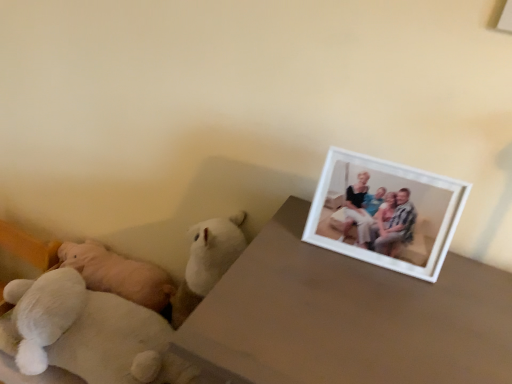
Question: Considering the relative positions of white plush teddy bear at left, which ranks as the 1th teddy bear in left-to-right order, and white plush teddy bear at lower left, the first teddy bear when ordered from right to left, in the image provided, is white plush teddy bear at left, which ranks as the 1th teddy bear in left-to-right order, to the right of white plush teddy bear at lower left, the first teddy bear when ordered from right to left, from the viewer's perspective?

Choices:
 (A) yes
 (B) no

Answer: (B)

Question: From a real-world perspective, does white plush teddy bear at left, marked as the first teddy bear in a back-to-front arrangement, sit lower than white plush teddy bear at lower left, the first teddy bear viewed from the front?

Choices:
 (A) no
 (B) yes

Answer: (B)

Question: Is white plush teddy bear at lower left, the first teddy bear viewed from the front, located within white plush teddy bear at left, which ranks as the 1th teddy bear in left-to-right order?

Choices:
 (A) no
 (B) yes

Answer: (A)

Question: Is the position of white plush teddy bear at left, marked as the first teddy bear in a back-to-front arrangement, less distant than that of white plush teddy bear at lower left, the first teddy bear when ordered from right to left?

Choices:
 (A) no
 (B) yes

Answer: (A)

Question: Can you confirm if white plush teddy bear at left, the 2th teddy bear positioned from the front, is thinner than white plush teddy bear at lower left, which is the 2th teddy bear in left-to-right order?

Choices:
 (A) no
 (B) yes

Answer: (B)

Question: Is white plush teddy bear at left, the 2th teddy bear positioned from the front, bigger than white plush teddy bear at lower left, the first teddy bear viewed from the front?

Choices:
 (A) yes
 (B) no

Answer: (A)

Question: Is white matte picture frame at upper right not close to white matte table at upper right?

Choices:
 (A) no
 (B) yes

Answer: (A)

Question: Does white matte picture frame at upper right have a greater width compared to white matte table at upper right?

Choices:
 (A) yes
 (B) no

Answer: (B)

Question: Is white matte picture frame at upper right shorter than white matte table at upper right?

Choices:
 (A) yes
 (B) no

Answer: (A)

Question: Is white matte picture frame at upper right aimed at white matte table at upper right?

Choices:
 (A) yes
 (B) no

Answer: (B)

Question: Is white matte picture frame at upper right oriented away from white matte table at upper right?

Choices:
 (A) no
 (B) yes

Answer: (A)

Question: Considering the relative sizes of white matte picture frame at upper right and white matte table at upper right in the image provided, is white matte picture frame at upper right thinner than white matte table at upper right?

Choices:
 (A) no
 (B) yes

Answer: (B)

Question: Is white plush teddy bear at lower left, the first teddy bear viewed from the front, aimed at white matte picture frame at upper right?

Choices:
 (A) no
 (B) yes

Answer: (A)